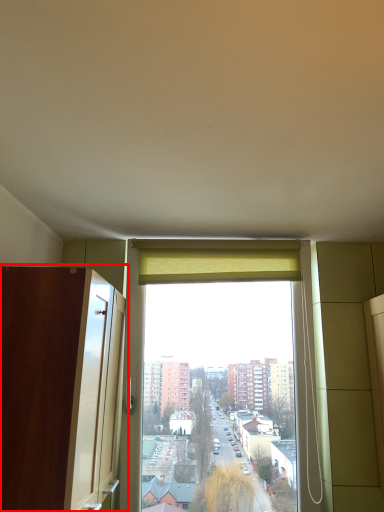
Question: Considering the relative positions of screen door (annotated by the red box) and curtain in the image provided, where is screen door (annotated by the red box) located with respect to the staircase?

Choices:
 (A) left
 (B) right

Answer: (A)